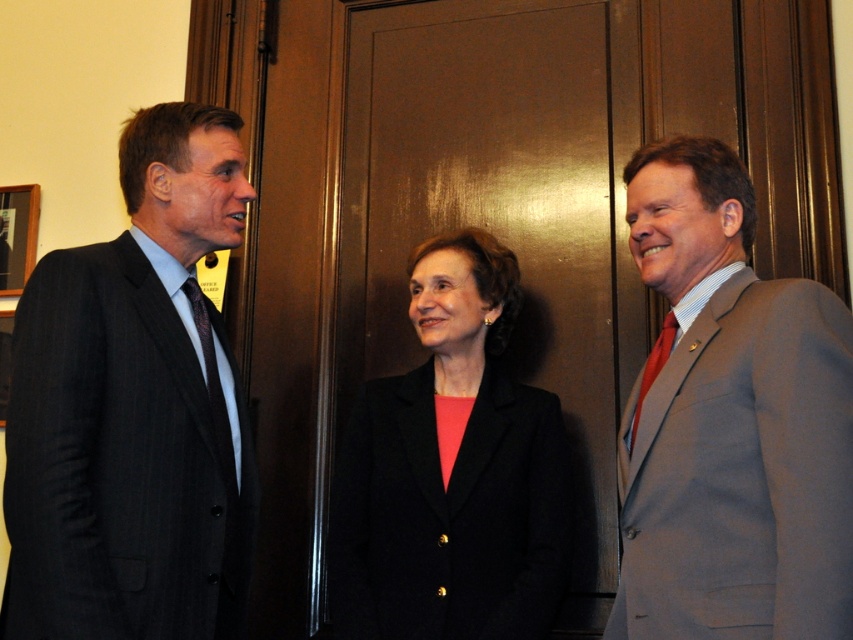
You are an event planner arranging a photo shoot in this scene. You need to position a spotlight so that it illuminates the red silk tie at right without shining on the black matte blazer at center. Is this possible based on their positions?

The red silk tie at right is behind the black matte blazer at center, so placing a spotlight in front of the black matte blazer at center would illuminate the red silk tie at right without shining on the black matte blazer at center.

You are organizing a formal event and need to seat guests based on their clothing. The dark gray suit at left and the gray wool suit at right are both present. Which guest should you seat first if you are following a rule that requires seating the wider person first?

The dark gray suit at left should be seated first because its width is larger than the gray wool suit at right, so it meets the seating rule requirement.

You are a tailor who needs to measure the space between the black matte blazer at center and the red silk tie at right for a custom fitting. Can you fit a 16 inch ruler between them?

The distance between the black matte blazer at center and the red silk tie at right is 18.03 inches, so yes, a 16 inch ruler can fit between them since it is shorter than the space available.